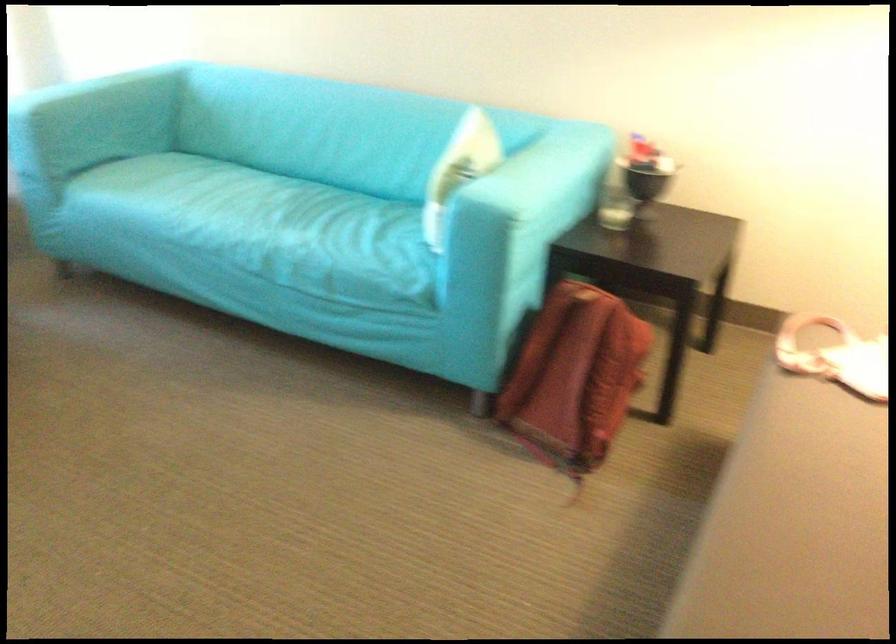
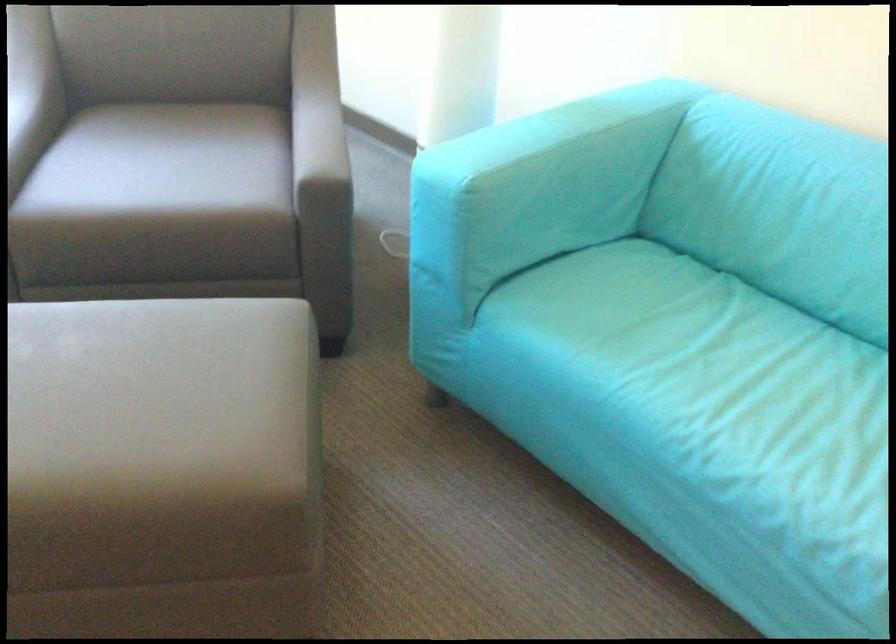
Find the pixel in the second image that matches the point at 74,95 in the first image.

(554, 162)